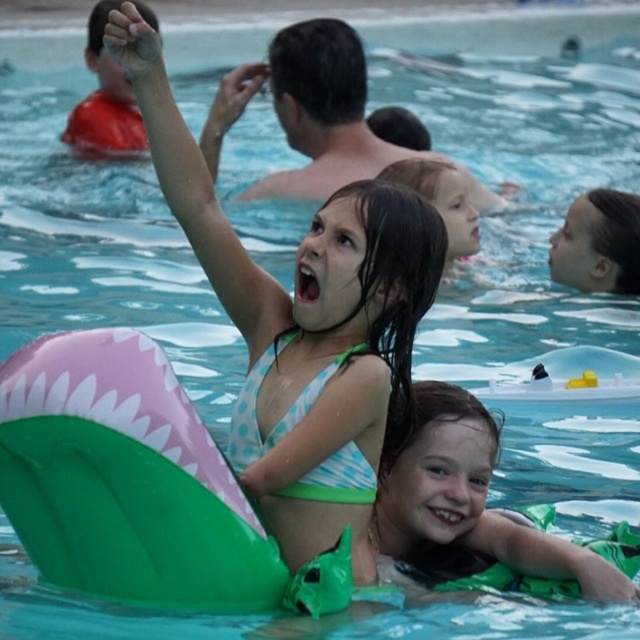
Between point (362, 388) and point (413, 157), which one is positioned in front?

Point (362, 388)

Is polka dot bikini at center behind light brown hair at upper center?

No, it is not.

Where is `polka dot bikini at center`? Image resolution: width=640 pixels, height=640 pixels. polka dot bikini at center is located at coordinates 301,324.

The width and height of the screenshot is (640, 640). What are the coordinates of `green rubber ring at lower right` in the screenshot? It's located at (467, 502).

Does green rubber ring at lower right appear on the left side of light brown hair at upper center?

Indeed, green rubber ring at lower right is positioned on the left side of light brown hair at upper center.

Where is `green rubber ring at lower right`? green rubber ring at lower right is located at coordinates (467, 502).

Is point (291, 442) behind point (541, 563)?

No, it is in front of (541, 563).

Does polka dot bikini at center lie in front of green rubber ring at lower right?

Yes, it is.

Measure the distance between point (108,29) and camera.

Point (108,29) is 15.77 meters away from camera.

Find the location of `polka dot bikini at center`. polka dot bikini at center is located at coordinates (301, 324).